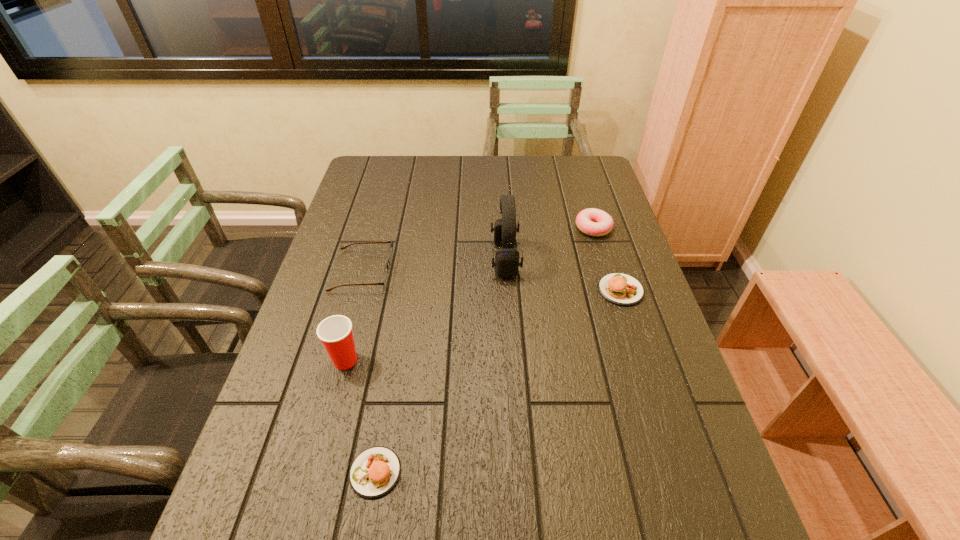
Identify the location of Dixie cup situated at the left edge. This screenshot has height=540, width=960. (335, 332).

Find the location of a particular element. patty that is positioned at the right edge is located at coordinates (618, 288).

You are a GUI agent. You are given a task and a screenshot of the screen. Output one action in this format:
    pyautogui.click(x=<x>, y=<y>)
    Task: Click on the doughnut that is at the right edge
    The image size is (960, 540).
    Given the screenshot: What is the action you would take?
    pyautogui.click(x=594, y=222)

Locate an element on the screen. The height and width of the screenshot is (540, 960). vacant space at the far edge of the desktop is located at coordinates (509, 170).

Find the location of a particular element. The image size is (960, 540). vacant space at the near edge is located at coordinates (631, 466).

Locate an element on the screen. This screenshot has height=540, width=960. free space at the left edge is located at coordinates (379, 206).

In the image, there is a desktop. Find the location of `free space at the right edge`. free space at the right edge is located at coordinates (573, 199).

In the image, there is a desktop. Find the location of `vacant space at the far left corner`. vacant space at the far left corner is located at coordinates (395, 156).

The width and height of the screenshot is (960, 540). In the image, there is a desktop. Find the location of `vacant space at the near left corner`. vacant space at the near left corner is located at coordinates (300, 491).

The image size is (960, 540). In the image, there is a desktop. In order to click on vacant area at the far right corner in this screenshot , I will do `click(564, 166)`.